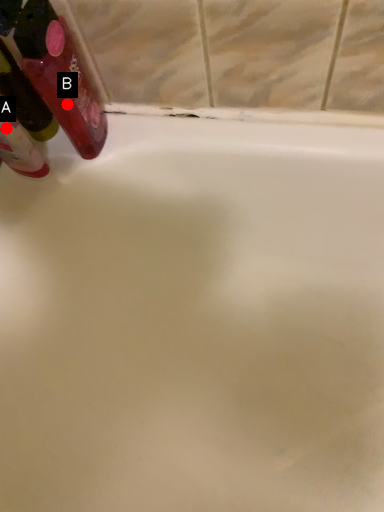
Question: Two points are circled on the image, labeled by A and B beside each circle. Which point is closer to the camera taking this photo?

Choices:
 (A) A is closer
 (B) B is closer

Answer: (A)